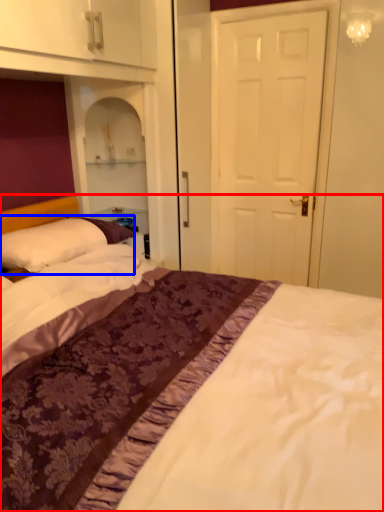
Question: Which object is closer to the camera taking this photo, bed (highlighted by a red box) or pillow (highlighted by a blue box)?

Choices:
 (A) bed
 (B) pillow

Answer: (A)